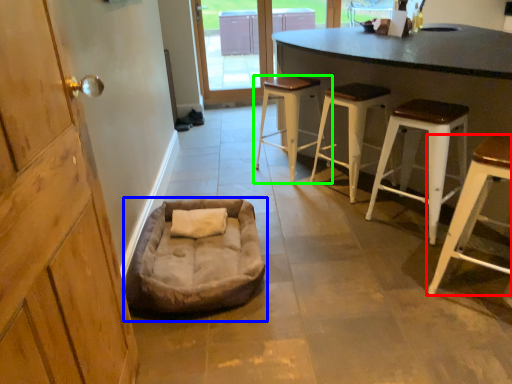
Question: Which is nearer to the stool (highlighted by a red box)? dog bed (highlighted by a blue box) or stool (highlighted by a green box).

Choices:
 (A) dog bed
 (B) stool

Answer: (A)